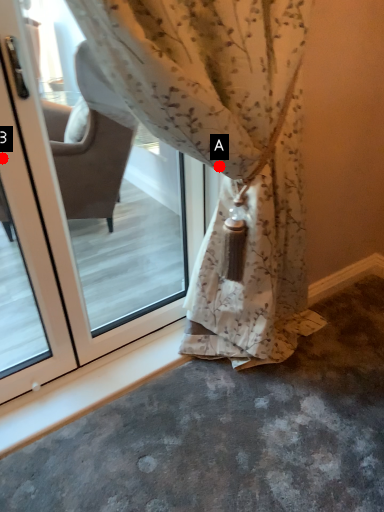
Question: Two points are circled on the image, labeled by A and B beside each circle. Which point is closer to the camera?

Choices:
 (A) A is closer
 (B) B is closer

Answer: (A)